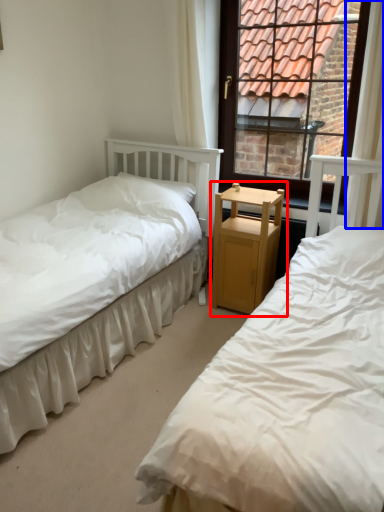
Question: Among these objects, which one is nearest to the camera, nightstand (highlighted by a red box) or curtain (highlighted by a blue box)?

Choices:
 (A) nightstand
 (B) curtain

Answer: (B)